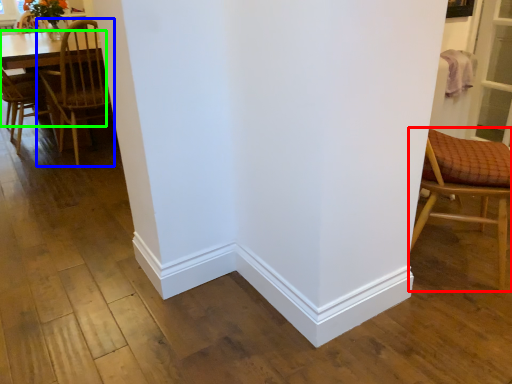
Question: Estimate the real-world distances between objects in this image. Which object is farther from chair (highlighted by a red box), chair (highlighted by a blue box) or table (highlighted by a green box)?

Choices:
 (A) chair
 (B) table

Answer: (B)